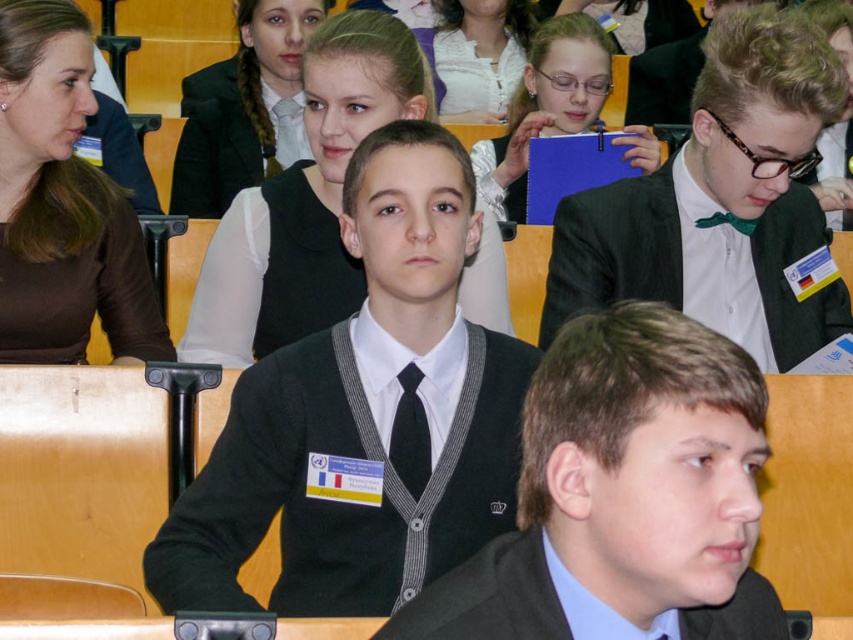
You are standing at the entrance of the lecture hall and want to find the black wool sweater at center. According to the coordinates provided, where should you look relative to the entrance?

The black wool sweater at center is located at coordinates point (363, 416), which means it is positioned 65.0 percent from the left edge and 42.7 percent from the bottom edge of the image. To locate it from the entrance, you should look towards the middle section of the room, slightly to the right and a bit above the lower half.

You are organizing a formal event and need to ensure that all attire meets specific width requirements for certain accessories. You have a black wool sweater at center and a green satin bow tie at upper right. Which accessory is narrower?

The black wool sweater at center is thinner than the green satin bow tie at upper right, so the black wool sweater at center is narrower.